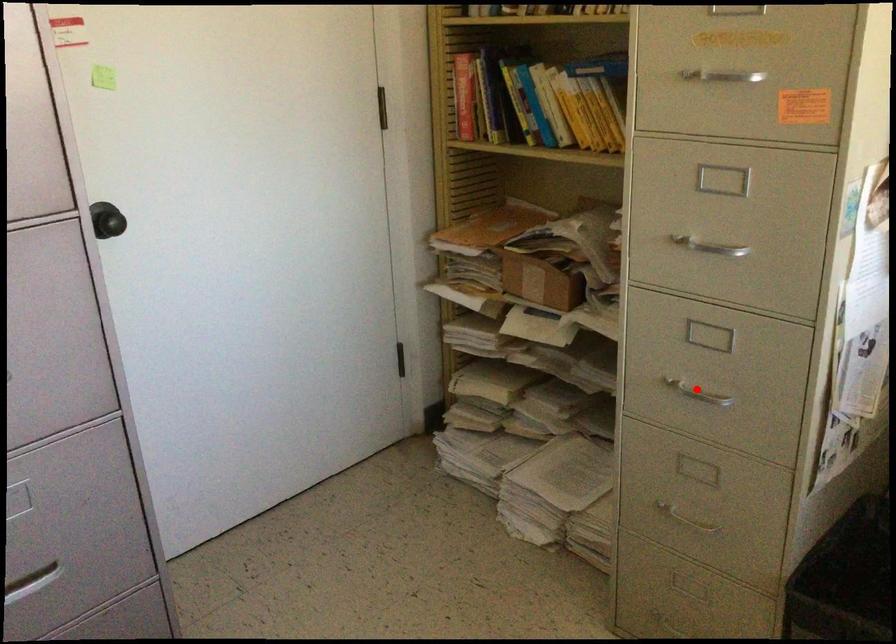
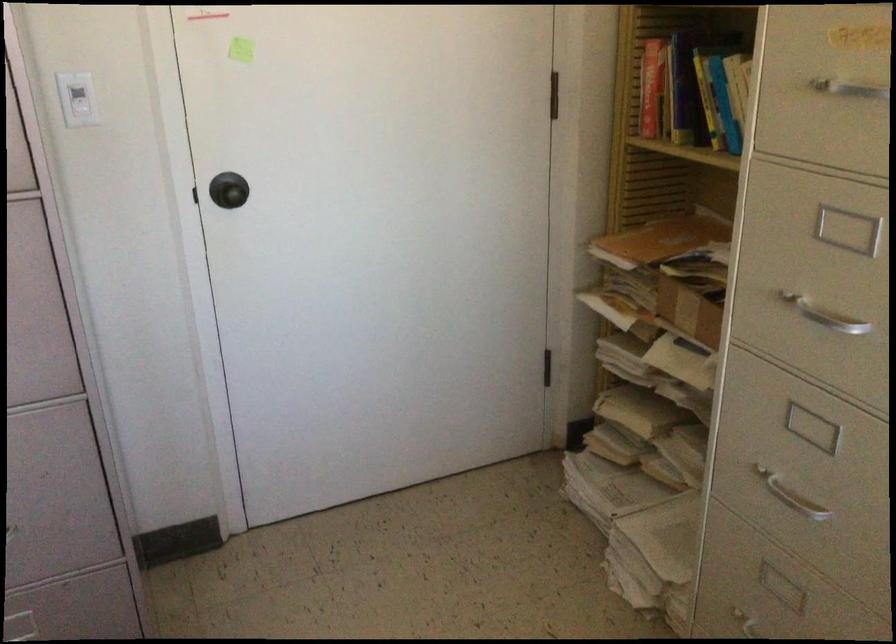
In the second image, find the point that corresponds to the highlighted location in the first image.

(790, 496)